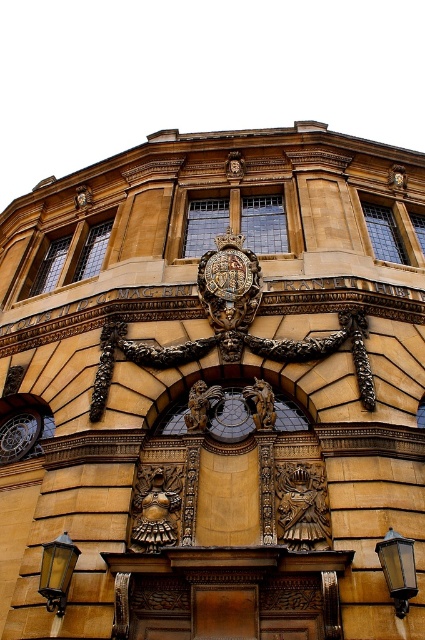
Is point (393, 563) positioned before point (73, 548)?

Yes, it is.

This screenshot has height=640, width=425. Identify the location of metallic glass lamp at lower right. (397, 568).

Between point (410, 586) and point (393, 172), which one is positioned behind?

The point (393, 172) is behind.

Who is lower down, metallic glass lamp at lower right or gold metallic clock at center?

metallic glass lamp at lower right is below.

Locate an element on the screen. This screenshot has width=425, height=640. metallic glass lamp at lower right is located at coordinates (397, 568).

Locate an element on the screen. The width and height of the screenshot is (425, 640). gold textured clock at center is located at coordinates (235, 166).

Does gold textured clock at center appear under gold metallic clock at center?

No, gold textured clock at center is not below gold metallic clock at center.

Does point (235, 163) come behind point (399, 186)?

No, it is in front of (399, 186).

The width and height of the screenshot is (425, 640). In order to click on gold textured clock at center in this screenshot , I will do `click(235, 166)`.